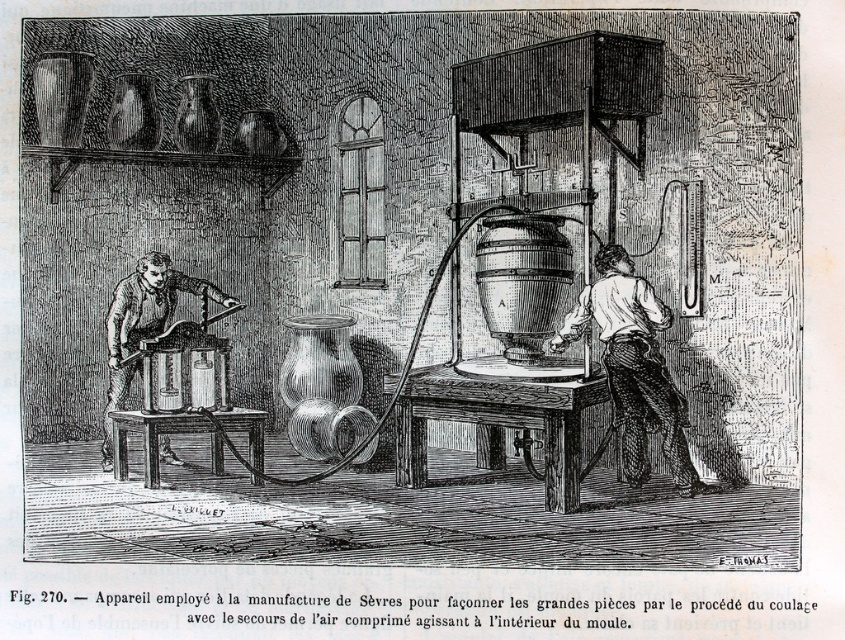
Question: Among these points, which one is nearest to the camera?

Choices:
 (A) (606, 312)
 (B) (132, 276)

Answer: (A)

Question: Is white cotton shirt at center further to the viewer compared to wooden saw at left?

Choices:
 (A) no
 (B) yes

Answer: (A)

Question: From the image, what is the correct spatial relationship of white cotton shirt at center in relation to wooden saw at left?

Choices:
 (A) left
 (B) right

Answer: (B)

Question: Among these objects, which one is nearest to the camera?

Choices:
 (A) white cotton shirt at center
 (B) wooden saw at left

Answer: (A)

Question: Does white cotton shirt at center have a larger size compared to wooden saw at left?

Choices:
 (A) no
 (B) yes

Answer: (A)